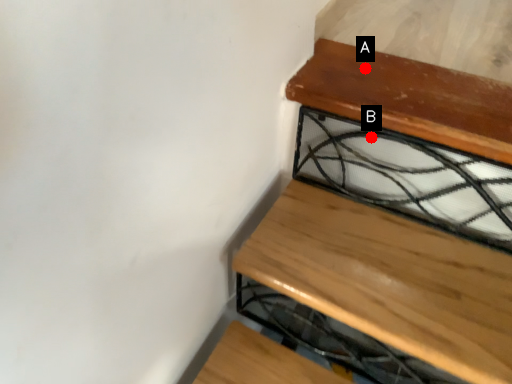
Question: Two points are circled on the image, labeled by A and B beside each circle. Which point is closer to the camera?

Choices:
 (A) A is closer
 (B) B is closer

Answer: (B)